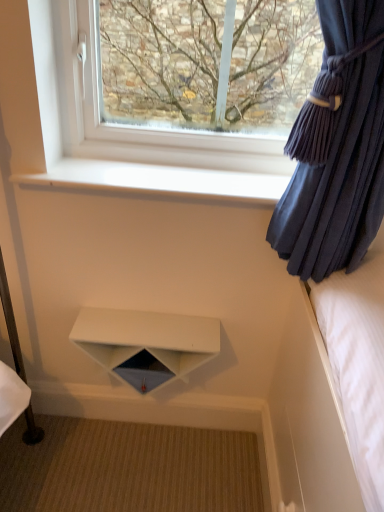
Locate an element on the screen. The image size is (384, 512). free space above white smooth window sill at upper center (from a real-world perspective) is located at coordinates 188,176.